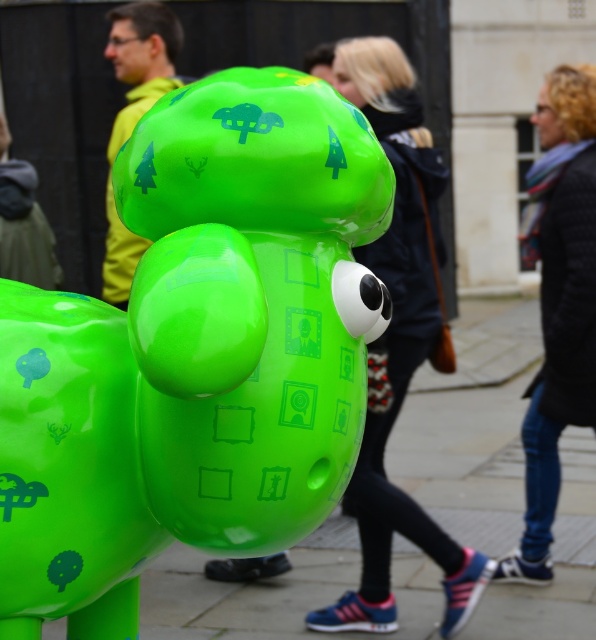
You are a photographer trying to capture a clear shot of the black textured coat at right while also including the matte green sculpture at center in the frame. Since the people in the background are moving, you need to adjust your focus. Which object should you focus on first to ensure both are in the frame?

The matte green sculpture at center is positioned on the left side of black textured coat at right, so you should focus on the matte green sculpture at center first to ensure both objects are within the frame.